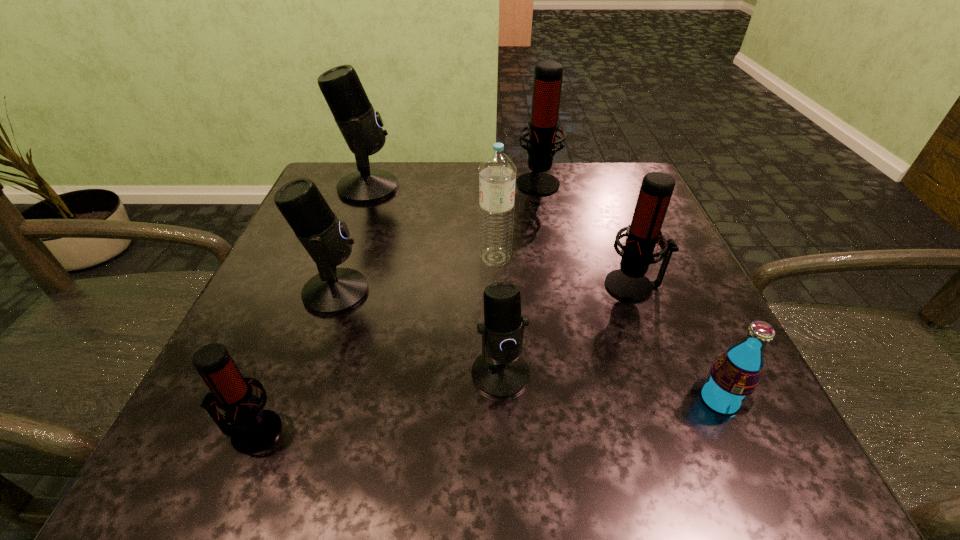
What are the coordinates of `vacant space at the right edge of the desktop` in the screenshot? It's located at (671, 278).

You are a GUI agent. You are given a task and a screenshot of the screen. Output one action in this format:
    pyautogui.click(x=<x>, y=<y>)
    Task: Click on the vacant space at the near left corner of the desktop
    The height and width of the screenshot is (540, 960).
    Given the screenshot: What is the action you would take?
    pyautogui.click(x=308, y=421)

At what (x,y) coordinates should I click in order to perform the action: click on free space at the far right corner of the desktop. Please return your answer as a coordinate pair (x, y). The width and height of the screenshot is (960, 540). Looking at the image, I should click on (588, 177).

At what (x,y) coordinates should I click in order to perform the action: click on unoccupied position between the second red microphone from right to left and the farthest black microphone. Please return your answer as a coordinate pair (x, y). Looking at the image, I should click on (453, 185).

Where is `free point between the nearest microphone and the soda`? The height and width of the screenshot is (540, 960). free point between the nearest microphone and the soda is located at coordinates (486, 416).

The width and height of the screenshot is (960, 540). I want to click on empty location between the biggest black microphone and the fifth microphone from left to right, so click(x=453, y=185).

At what (x,y) coordinates should I click in order to perform the action: click on vacant point located between the second red microphone from right to left and the smallest red microphone. Please return your answer as a coordinate pair (x, y). This screenshot has width=960, height=540. Looking at the image, I should click on (395, 307).

Image resolution: width=960 pixels, height=540 pixels. What are the coordinates of `vacant area that lies between the biggest black microphone and the sixth object from left to right` in the screenshot? It's located at (453, 185).

At what (x,y) coordinates should I click in order to perform the action: click on vacant point located between the second biggest red microphone and the farthest red microphone. Please return your answer as a coordinate pair (x, y). The height and width of the screenshot is (540, 960). Looking at the image, I should click on (586, 234).

Identify the location of free area in between the rightmost microphone and the water bottle. (564, 272).